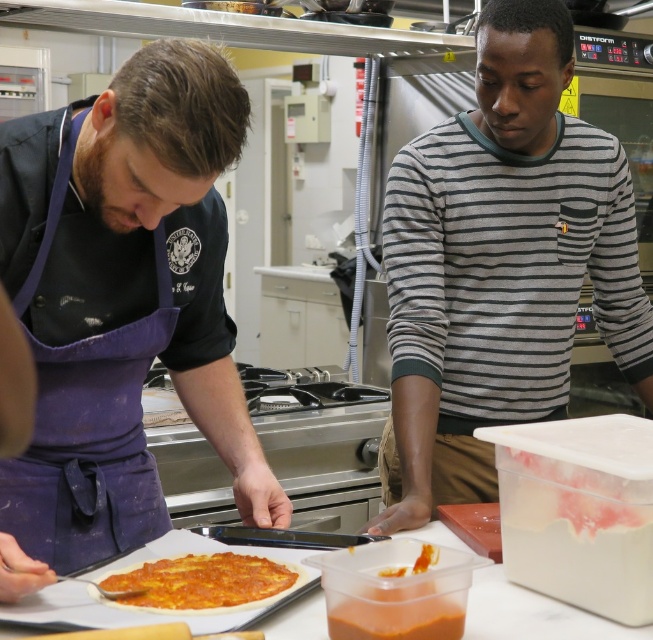
You are a photographer setting up for a food photography shoot in this kitchen scene. You need to position a light source so that it illuminates both the purple apron at left and the gray striped sweater at center without casting shadows. Based on their positions, where should you place the light source relative to these two objects?

The purple apron at left is located below the gray striped sweater at center. To illuminate both without casting shadows, the light source should be placed above and between the two objects, ensuring it reaches both the lower purple apron and the higher gray striped sweater.

You are a student in the cooking class and need to add cheese to the pizza. The pizza base is at the center of the image. Where should you place the cheese relative to the point marked at coordinates point (394, 592)?

The point (394, 592) marks the smooth orange sauce at center, so you should place the cheese on top of the smooth orange sauce at center which is located at that coordinate.

You are in a kitchen setting where two people are preparing a pizza. The person on the left is wearing a purple apron and a dark shirt with a United States eagle emblem. The person on the right is in a gray and black striped shirt. A point labeled as point (x=121, y=305) is marked in the scene. Which object does this point correspond to?

The point (x=121, y=305) marks the purple apron at left.